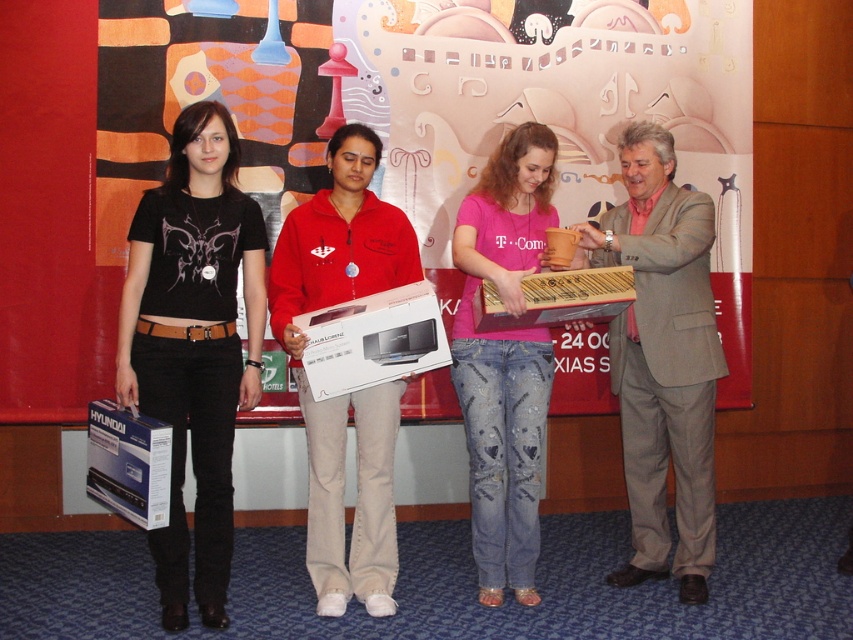
You are attending a presentation and want to take a photo of the person wearing the pink cotton shirt at center without including the matte red hoodie at center in the frame. Is this possible given their positions?

The matte red hoodie at center is closer to the viewer than the pink cotton shirt at center, so it would block the view of the pink cotton shirt at center. Therefore, it might not be possible to take a photo of the pink cotton shirt at center without including the matte red hoodie at center in the frame.